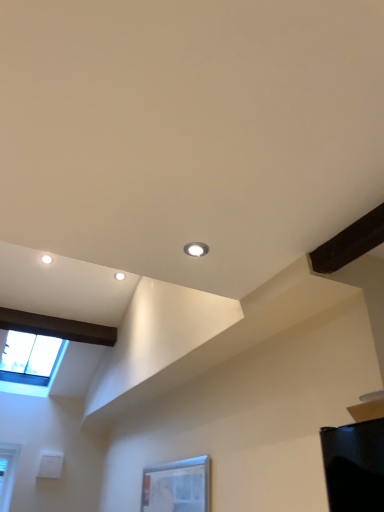
Question: Is transparent glass window at upper left, which appears as the 2th window when viewed from the front, bigger than matte white droplight at upper center?

Choices:
 (A) yes
 (B) no

Answer: (A)

Question: From the image's perspective, is transparent glass window at upper left, which appears as the 2th window when viewed from the front, located beneath matte white droplight at upper center?

Choices:
 (A) yes
 (B) no

Answer: (A)

Question: Is transparent glass window at upper left, the 1th window from the left, positioned far away from matte white droplight at upper center?

Choices:
 (A) yes
 (B) no

Answer: (A)

Question: Is transparent glass window at upper left, which ranks as the 2th window in right-to-left order, beside matte white droplight at upper center?

Choices:
 (A) yes
 (B) no

Answer: (B)

Question: Is transparent glass window at upper left, which ranks as the 2th window in right-to-left order, at the right side of matte white droplight at upper center?

Choices:
 (A) no
 (B) yes

Answer: (A)

Question: Can you confirm if transparent glass window at upper left, which appears as the 2th window when viewed from the front, is shorter than matte white droplight at upper center?

Choices:
 (A) yes
 (B) no

Answer: (B)

Question: Is transparent glass window at lower center, the second window when ordered from back to front, shorter than matte white droplight at upper center?

Choices:
 (A) no
 (B) yes

Answer: (A)

Question: Is transparent glass window at lower center, which is the 1th window in front-to-back order, positioned beyond the bounds of matte white droplight at upper center?

Choices:
 (A) yes
 (B) no

Answer: (A)

Question: Is transparent glass window at lower center, placed as the first window when sorted from right to left, facing away from matte white droplight at upper center?

Choices:
 (A) yes
 (B) no

Answer: (B)

Question: Could you tell me if transparent glass window at lower center, which ranks as the 2th window in left-to-right order, is turned towards matte white droplight at upper center?

Choices:
 (A) yes
 (B) no

Answer: (B)

Question: Is transparent glass window at lower center, the second window when ordered from back to front, wider than matte white droplight at upper center?

Choices:
 (A) yes
 (B) no

Answer: (B)

Question: Can you confirm if transparent glass window at lower center, which is the 1th window in front-to-back order, is bigger than matte white droplight at upper center?

Choices:
 (A) no
 (B) yes

Answer: (B)

Question: Would you say transparent glass window at lower center, which is the 1th window in front-to-back order, is part of matte white droplight at upper center's contents?

Choices:
 (A) no
 (B) yes

Answer: (A)